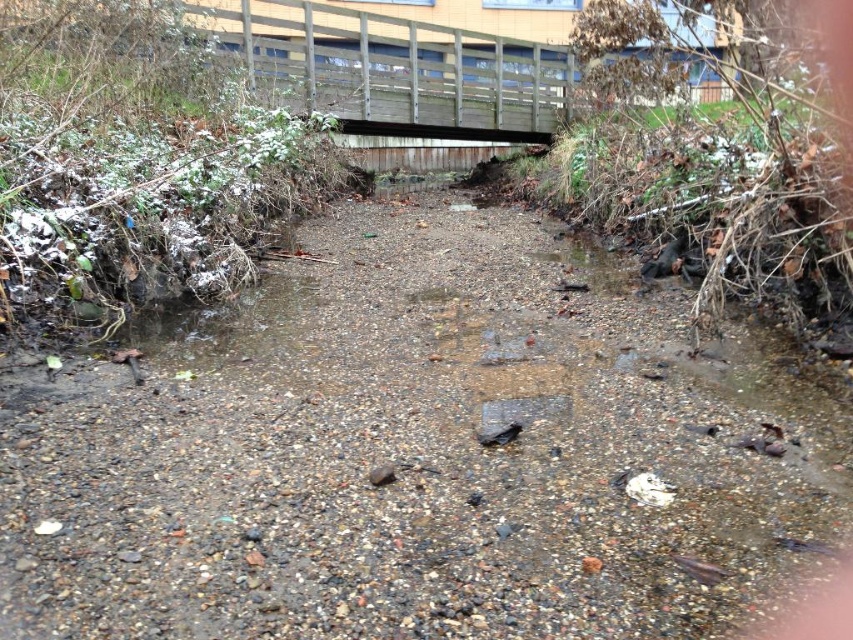
You are planning to cross the stream using either the brown gravel path at center or the wooden bridge at upper center. Which option is shorter in length?

The brown gravel path at center is shorter than the wooden bridge at upper center, so you should choose the brown gravel path at center for a shorter crossing.

You are standing at the edge of the stream and want to place a small marker at point (335,596) and another marker at point (701,26). Which marker will be closer to your current position?

The marker at point (335,596) will be closer to your current position because it is closer to the camera than point (701,26).